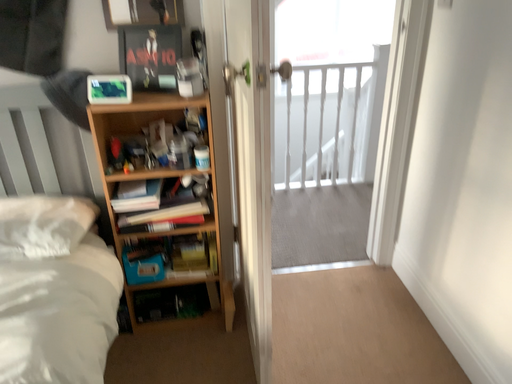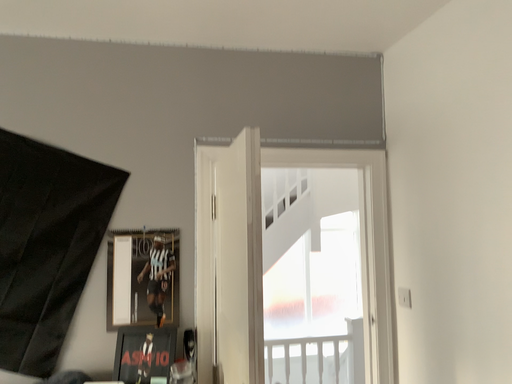
Question: Which way did the camera rotate in the video?

Choices:
 (A) rotated upward
 (B) rotated downward

Answer: (A)